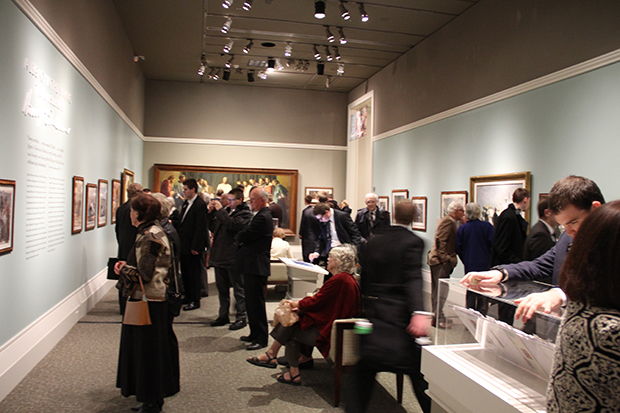
At what (x,y) coordinates should I click in order to perform the action: click on framed painting on right wall. Please return your answer as a coordinate pair (x, y). Image resolution: width=620 pixels, height=413 pixels. Looking at the image, I should click on (490, 196), (449, 197), (422, 204), (394, 192), (384, 199).